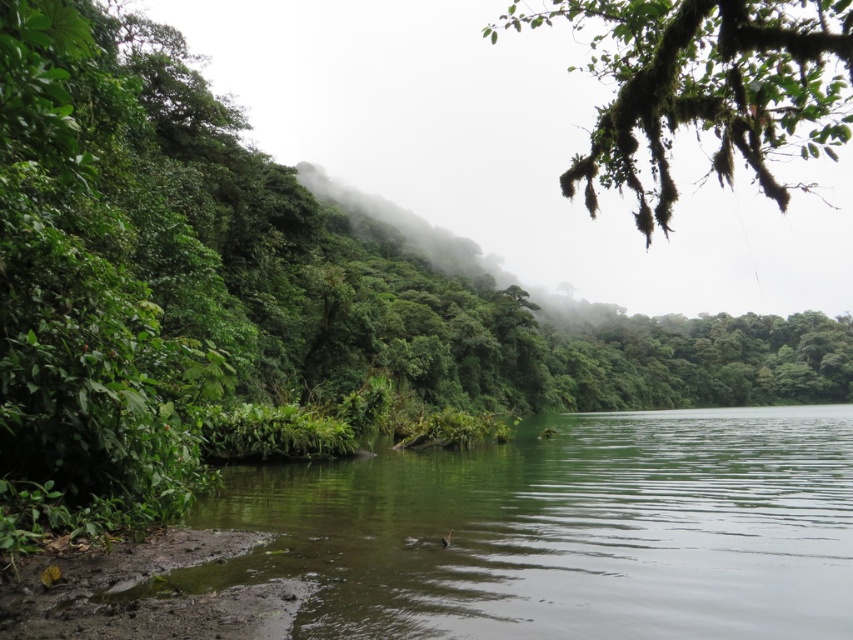
You are an explorer navigating through this landscape. You see the green mossy branch at upper right and the green leafy fog at center. Which object is located to the right of the other?

The green mossy branch at upper right is positioned on the right side of green leafy fog at center.

You are an explorer navigating through this landscape and need to determine which object is nearer to you. You see the green mossy branch at upper right and the green leafy fog at center. Which one is closer to your current position?

The green mossy branch at upper right is closer to the viewer than the green leafy fog at center.

You are standing at the edge of the water in the scene. Which object, the green smooth water at lower center or the green leafy fog at center, is closer to your feet?

The green smooth water at lower center is closer to your feet since it is located below the green leafy fog at center.